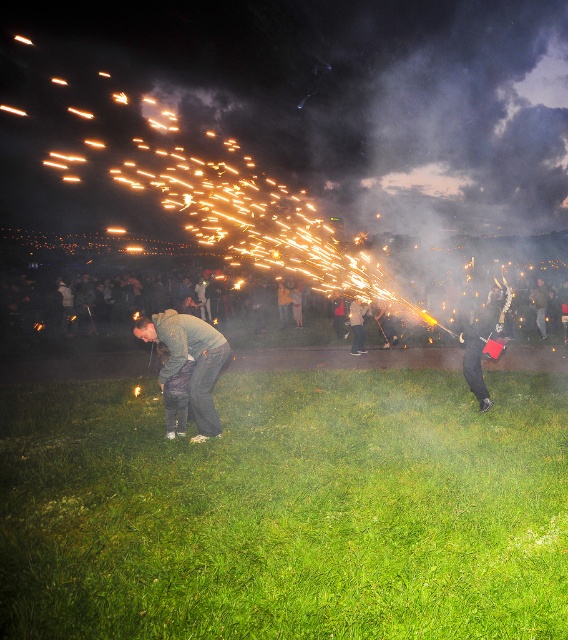
Question: Is dark gray hoodie at center above dark gray pants at center?

Choices:
 (A) no
 (B) yes

Answer: (A)

Question: Is dark gray hoodie at center thinner than metallic guitar at right?

Choices:
 (A) yes
 (B) no

Answer: (B)

Question: Which of these objects is positioned closest to the metallic guitar at right?

Choices:
 (A) dark gray hoodie at center
 (B) dark gray pants at center
 (C) green grass at lower center
 (D) dark gray fabric jacket at center

Answer: (A)

Question: Among these points, which one is nearest to the camera?

Choices:
 (A) (490, 320)
 (B) (361, 333)

Answer: (A)

Question: Does metallic guitar at right appear on the left side of dark gray pants at center?

Choices:
 (A) no
 (B) yes

Answer: (A)

Question: Which object is closer to the camera taking this photo?

Choices:
 (A) metallic guitar at right
 (B) dark gray pants at center
 (C) dark gray fabric jacket at center
 (D) green grass at lower center

Answer: (D)